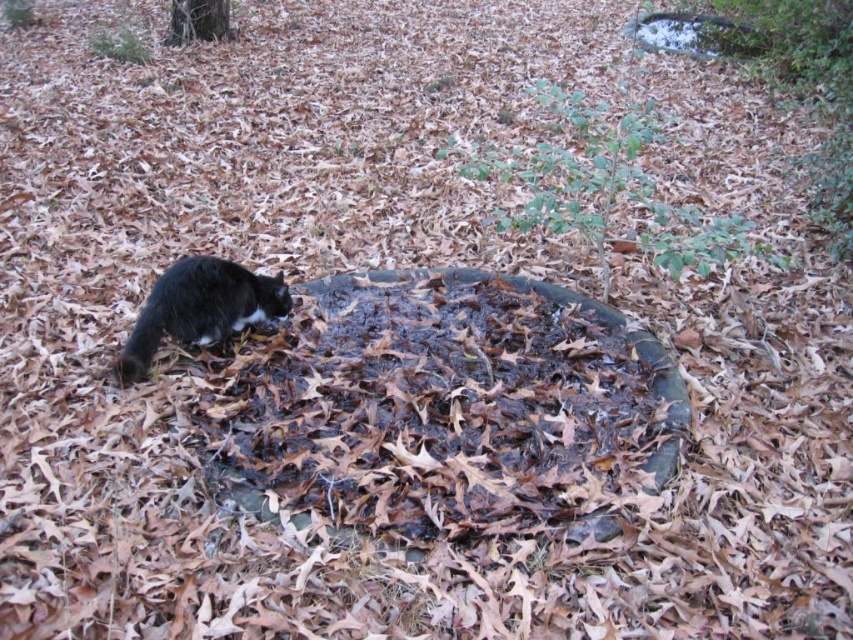
Does point (206, 326) come farther from viewer compared to point (181, 1)?

No, it is not.

Which is in front, point (148, 304) or point (222, 8)?

Positioned in front is point (148, 304).

The height and width of the screenshot is (640, 853). What are the coordinates of `black fur cat at lower left` in the screenshot? It's located at (199, 308).